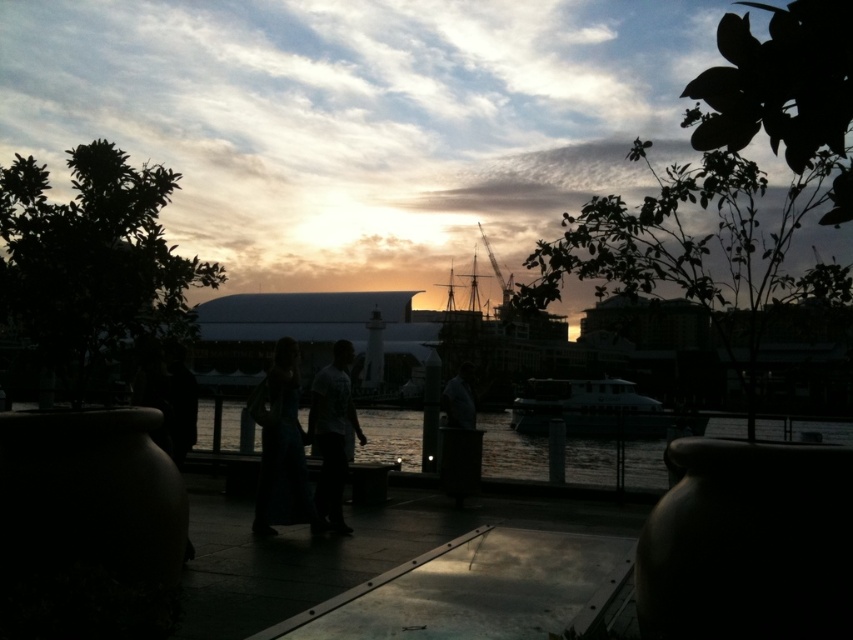
You are a photographer standing at the riverside path. You want to capture a photo of both the white glossy boat at center and the matte green dress at center in the same frame. Given the distance between them, will you need to adjust your camera lens to a wider angle to include both subjects?

The distance between the white glossy boat at center and the matte green dress at center is 23.56 feet. To capture both in the same frame, you would need to use a wider angle lens to accommodate the space between them.

You are standing on the riverside path and see the transparent glass water at center and the white glossy boat at center. Which object is positioned to the left of the other?

The transparent glass water at center is to the left of the white glossy boat at center.